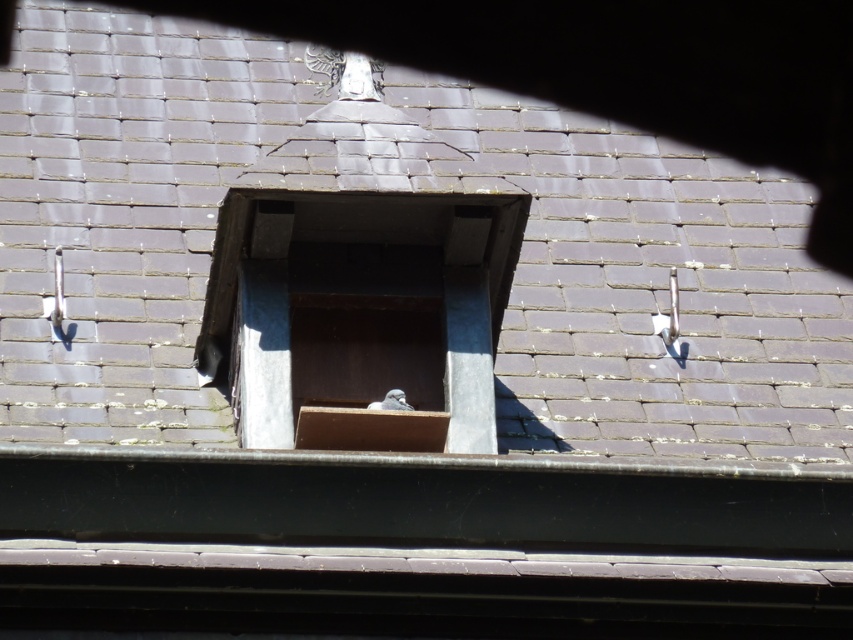
Question: Which is farther from the white feathered bird at center?

Choices:
 (A) smooth slate roof at center
 (B) wooden box at center

Answer: (A)

Question: Which object is the closest to the smooth slate roof at center?

Choices:
 (A) wooden box at center
 (B) white feathered bird at center

Answer: (B)

Question: Is smooth slate roof at center to the right of white feathered bird at center from the viewer's perspective?

Choices:
 (A) yes
 (B) no

Answer: (A)

Question: Is smooth slate roof at center thinner than white feathered bird at center?

Choices:
 (A) no
 (B) yes

Answer: (A)

Question: Which point is closer to the camera taking this photo?

Choices:
 (A) (677, 196)
 (B) (407, 408)

Answer: (B)

Question: Does wooden box at center have a greater width compared to white feathered bird at center?

Choices:
 (A) yes
 (B) no

Answer: (B)